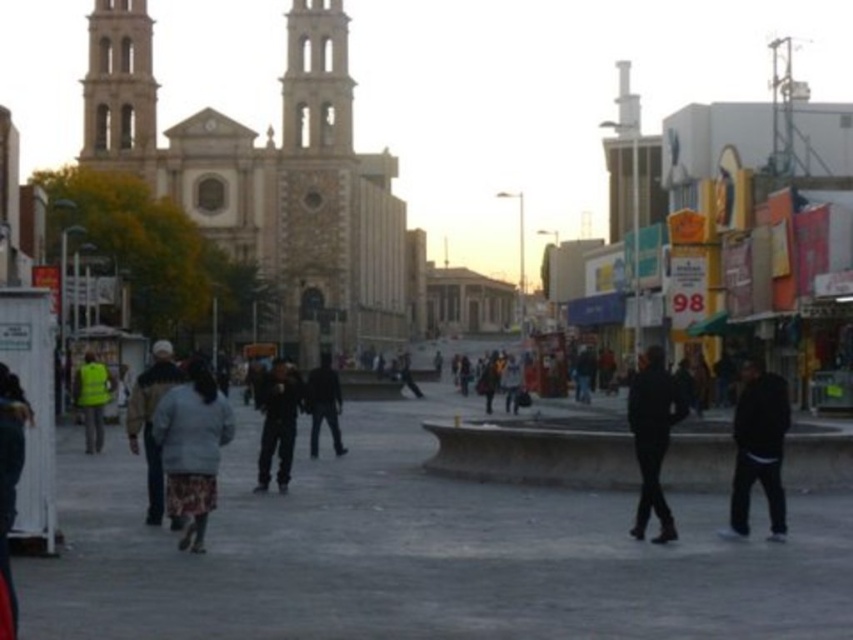
You are standing in the plaza in front of the cathedral and want to locate the dark gray pants at center. Which direction should you look to find them?

The dark gray pants at center is located at point 0.659 on the x axis and 0.326 on the y axis, so you should look towards the central area slightly to the right.